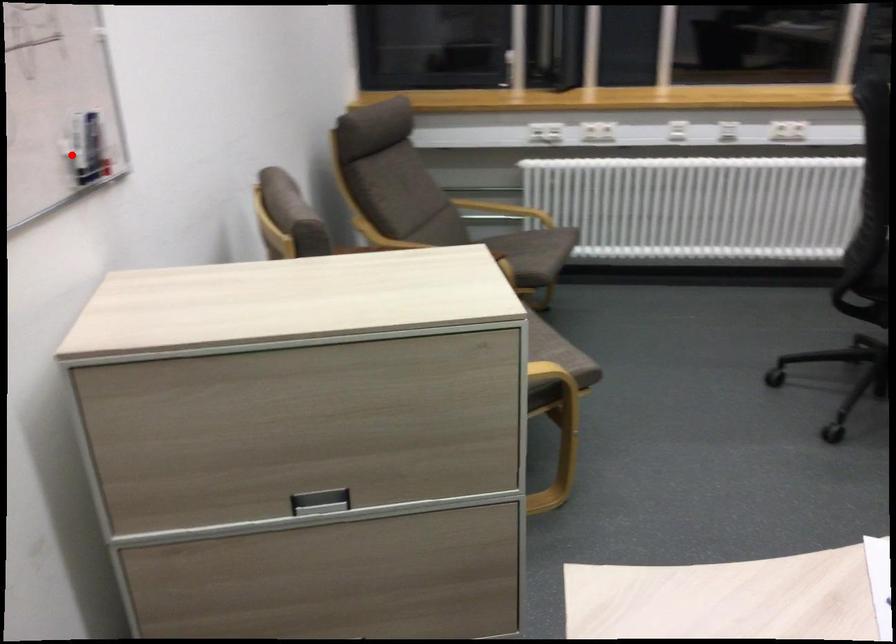
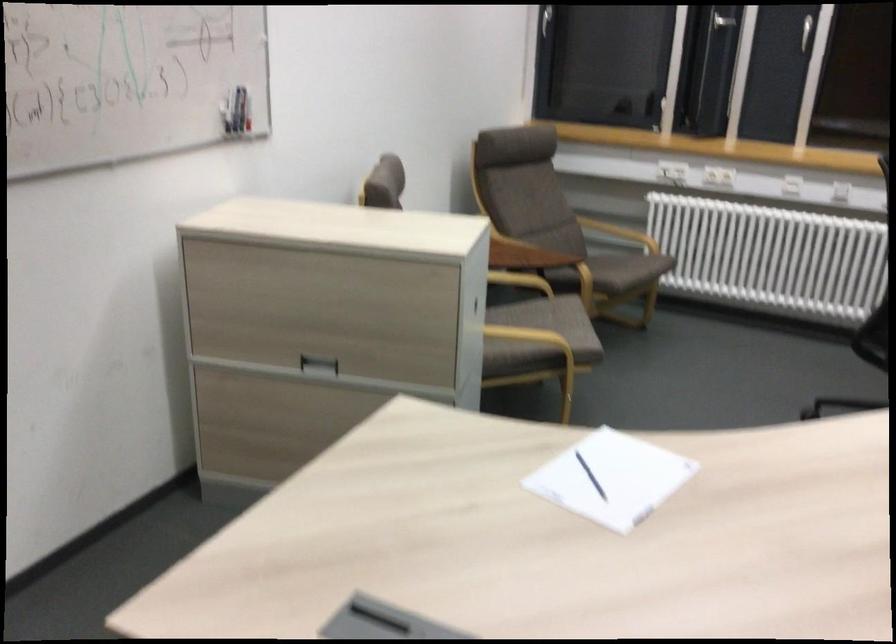
Question: A red point is marked in image1. In image2, is the corresponding 3D point closer to the camera or farther? Reply with the corresponding letter.

Choices:
 (A) The corresponding 3D point is closer.
 (B) The corresponding 3D point is farther.

Answer: (B)